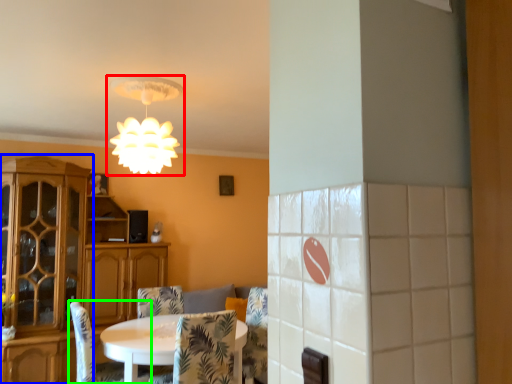
Question: Considering the real-world distances, which object is farthest from lamp (highlighted by a red box)? cabinetry (highlighted by a blue box) or chair (highlighted by a green box)?

Choices:
 (A) cabinetry
 (B) chair

Answer: (A)